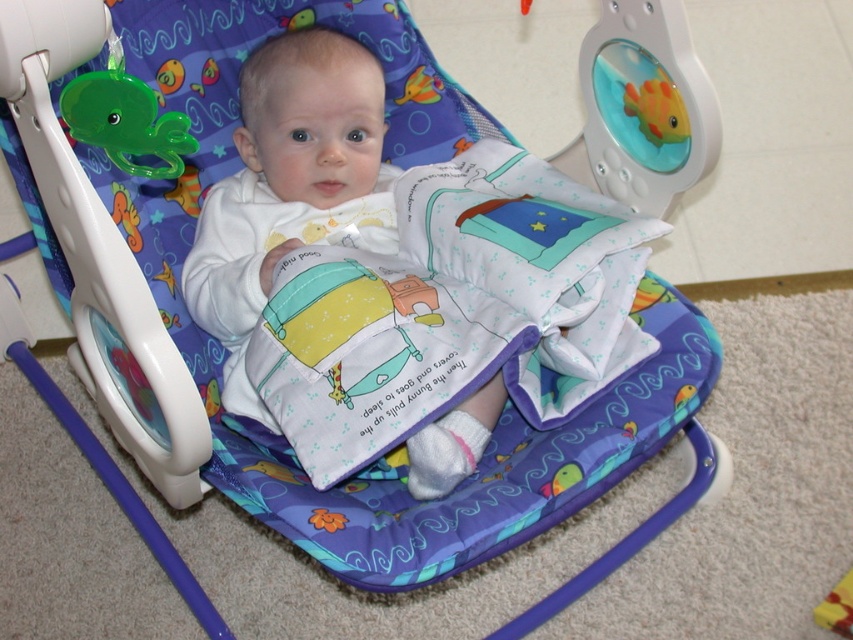
You are a toy organizer in a nursery. You need to place a green plastic octopus at upper left into a storage bin that can only hold items smaller than the white soft baby at center. Will the octopus fit?

The white soft baby at center is bigger than the green plastic octopus at upper left, so the octopus will fit in the storage bin since it is smaller than the baby.

You are a parent trying to locate your baby in the room. You see a green plastic octopus at upper left and a white soft baby at center. Which object is positioned further to the left?

The green plastic octopus at upper left is positioned further to the left compared to the white soft baby at center.

Consider the image. You are a photographer taking a picture of the baby in the bouncer chair. You need to position your camera so that both the point at [337,58] and the point at [61,102] are visible in the frame. Based on their positions, which point should be closer to the back of the frame?

Point [337,58] is behind point [61,102], so it should be placed closer to the back of the frame.